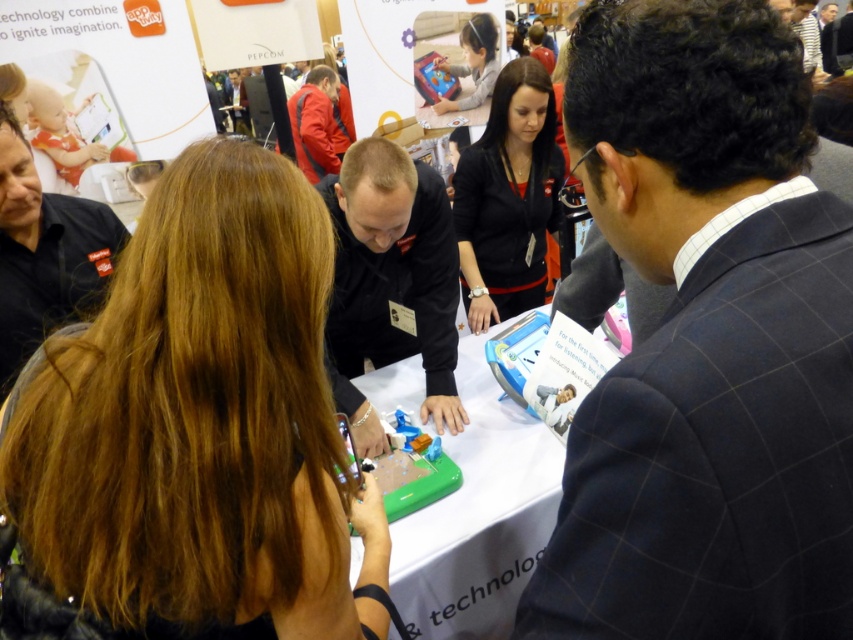
Based on the photo, is dark blue checkered suit at center bigger than black matte jacket at center?

No, dark blue checkered suit at center is not bigger than black matte jacket at center.

Looking at this image, does dark blue checkered suit at center appear on the left side of black matte jacket at center?

Yes, dark blue checkered suit at center is to the left of black matte jacket at center.

Describe the element at coordinates (706, 342) in the screenshot. I see `dark blue checkered suit at center` at that location.

Find the location of a particular element. The width and height of the screenshot is (853, 640). dark blue checkered suit at center is located at coordinates (706, 342).

Can you confirm if dark blue checkered suit at center is bigger than matte black tablet at upper center?

Indeed, dark blue checkered suit at center has a larger size compared to matte black tablet at upper center.

Between point (733, 12) and point (469, 72), which one is positioned in front?

Point (733, 12) is in front.

I want to click on dark blue checkered suit at center, so click(x=706, y=342).

Is brown hair at center further to camera compared to matte black tablet at upper center?

That is False.

Locate an element on the screen. The width and height of the screenshot is (853, 640). brown hair at center is located at coordinates (192, 433).